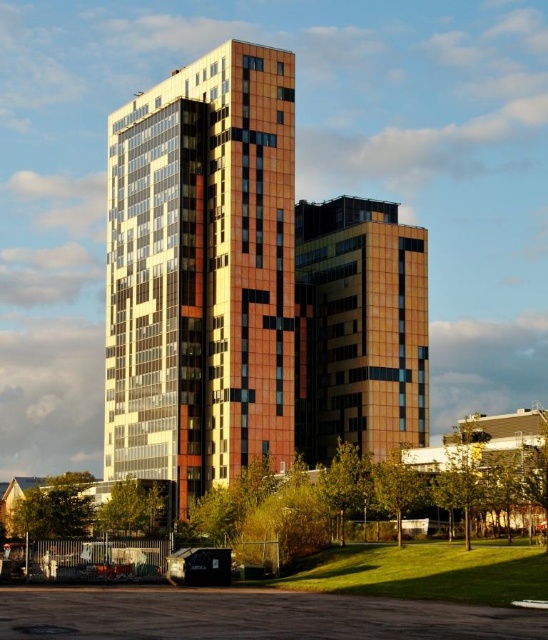
In the scene shown: You are standing in front of the two buildings shown in the image. The multicolored mosaic building at center and the orange glass building at center are both part of the architectural complex. From your vantage point, which building appears higher in the image?

The multicolored mosaic building at center is above the orange glass building at center, so it appears higher in the image.

You are a drone operator tasked with capturing aerial footage of the multicolored mosaic building at center and the orange glass building at center. If your drone can only fly up to the height of the shorter building, which building should you focus on to ensure the drone doesn

The orange glass building at center is shorter than the multicolored mosaic building at center. Since the drone can only fly up to the height of the shorter building, you should focus on capturing the orange glass building at center to ensure the drone can safely operate without exceeding its maximum altitude.